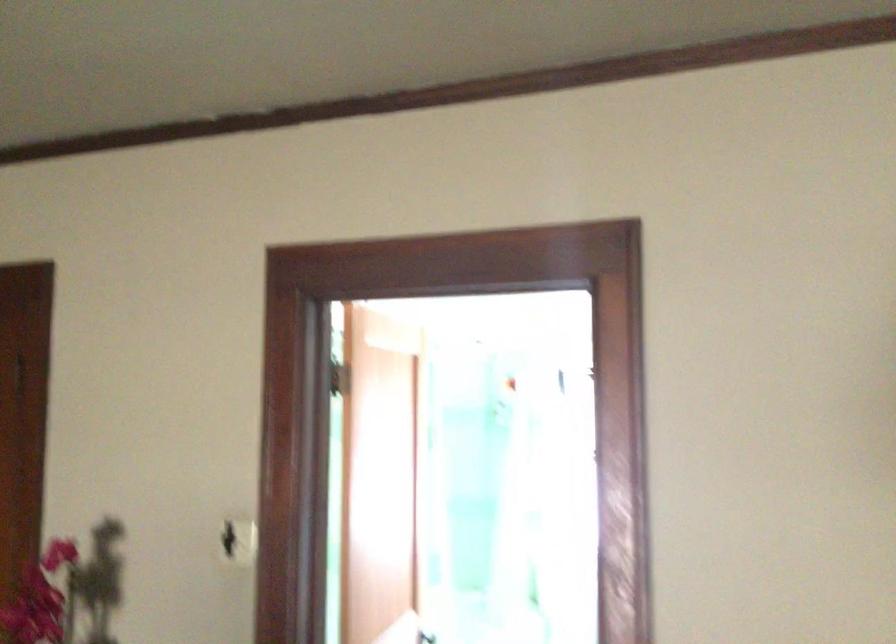
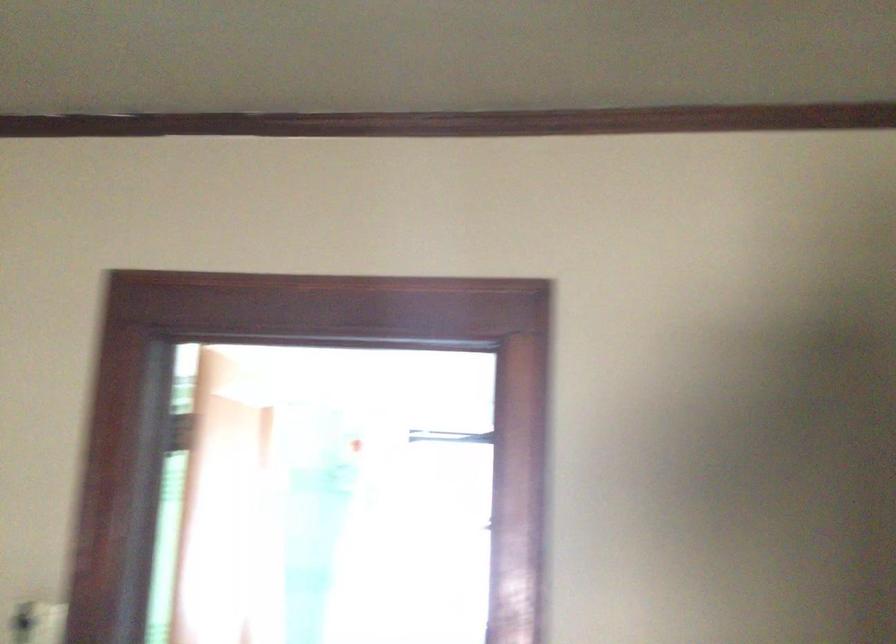
Locate, in the second image, the point that corresponds to point (238, 534) in the first image.

(36, 623)